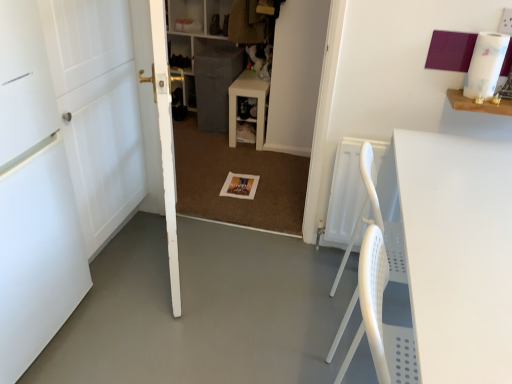
At what (x,y) coordinates should I click in order to perform the action: click on free spot in front of matte white table at center, the 2th table in the right-to-left sequence. Please return your answer as a coordinate pair (x, y). The image size is (512, 384). Looking at the image, I should click on (247, 157).